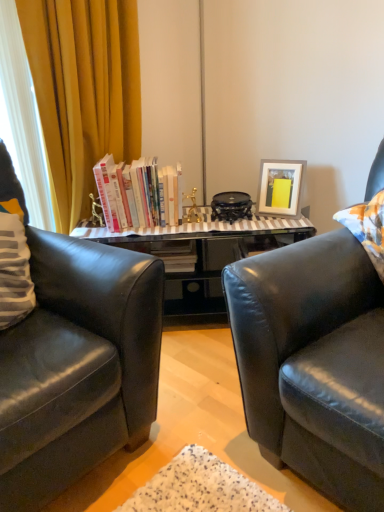
Describe the element at coordinates (77, 366) in the screenshot. I see `black leather chair at left` at that location.

This screenshot has width=384, height=512. What do you see at coordinates (138, 193) in the screenshot? I see `hardcover books at center` at bounding box center [138, 193].

Describe the element at coordinates (83, 91) in the screenshot. I see `yellow fabric curtain at left` at that location.

This screenshot has width=384, height=512. What are the coordinates of `black leather chair at left` in the screenshot? It's located at (77, 366).

In the scene shown: From a real-world perspective, relative to matte gray picture frame at upper right, is hardcover books at center vertically above or below?

hardcover books at center is above matte gray picture frame at upper right.

Can you confirm if hardcover books at center is taller than matte gray picture frame at upper right?

Correct, hardcover books at center is much taller as matte gray picture frame at upper right.

Is hardcover books at center turned away from matte gray picture frame at upper right?

No, matte gray picture frame at upper right is not at the back of hardcover books at center.

Is matte gray picture frame at upper right looking in the opposite direction of black leather chair at left?

That's not correct — matte gray picture frame at upper right is not looking away from black leather chair at left.

Between matte gray picture frame at upper right and black leather chair at left, which one appears on the left side from the viewer's perspective?

black leather chair at left is more to the left.

Would you consider matte gray picture frame at upper right to be distant from black leather chair at left?

Yes, matte gray picture frame at upper right and black leather chair at left are located far from each other.

Which object is positioned more to the right, yellow fabric curtain at left or black leather chair at left?

From the viewer's perspective, yellow fabric curtain at left appears more on the right side.

Between point (100, 34) and point (0, 380), which one is positioned in front?

The point (0, 380) is closer.

Identify the location of chair located below the yellow fabric curtain at left (from the image's perspective). (77, 366).

Is black leather chair at left placed right next to matte gray picture frame at upper right?

black leather chair at left and matte gray picture frame at upper right are not in contact.

From the image's perspective, would you say black leather chair at left is shown under matte gray picture frame at upper right?

Correct, black leather chair at left appears lower than matte gray picture frame at upper right in the image.

The width and height of the screenshot is (384, 512). I want to click on picture frame above the black leather chair at left (from the image's perspective), so click(x=280, y=187).

Can you tell me how much yellow fabric curtain at left and hardcover books at center differ in facing direction?

The angle between the facing direction of yellow fabric curtain at left and the facing direction of hardcover books at center is 41.5 degrees.

From a real-world perspective, relative to hardcover books at center, is yellow fabric curtain at left vertically above or below?

From a real-world perspective, yellow fabric curtain at left is physically above hardcover books at center.

Is yellow fabric curtain at left at the left side of hardcover books at center?

Yes, yellow fabric curtain at left is to the left of hardcover books at center.

Which of these two, black leather chair at left or yellow fabric curtain at left, stands shorter?

black leather chair at left is shorter.

Is black leather chair at left closer to the viewer compared to yellow fabric curtain at left?

That is True.

Consider the image. Considering the positions of objects black leather chair at left and yellow fabric curtain at left in the image provided, who is more to the right, black leather chair at left or yellow fabric curtain at left?

Positioned to the right is yellow fabric curtain at left.

From the image's perspective, which is above, black leather chair at left or yellow fabric curtain at left?

yellow fabric curtain at left appears higher in the image.

Is point (283, 173) closer or farther from the camera than point (56, 69)?

Point (283, 173) appears to be farther away from the viewer than point (56, 69).

What's the angular difference between matte gray picture frame at upper right and yellow fabric curtain at left's facing directions?

There is a 72.2-degree angle between the facing directions of matte gray picture frame at upper right and yellow fabric curtain at left.

Is matte gray picture frame at upper right looking in the opposite direction of yellow fabric curtain at left?

matte gray picture frame at upper right is not turned away from yellow fabric curtain at left.

Is matte gray picture frame at upper right at the right side of yellow fabric curtain at left?

Indeed, matte gray picture frame at upper right is positioned on the right side of yellow fabric curtain at left.

Where is `picture frame behind the hardcover books at center`? picture frame behind the hardcover books at center is located at coordinates (280, 187).

Locate an element on the screen. The image size is (384, 512). picture frame on the right of black leather chair at left is located at coordinates (280, 187).

Which object lies further to the anchor point matte gray picture frame at upper right, hardcover books at center or black leather chair at left?

black leather chair at left lies further to matte gray picture frame at upper right than the other object.

From the image, which object appears to be farther from hardcover books at center, black leather chair at left or yellow fabric curtain at left?

Among the two, black leather chair at left is located further to hardcover books at center.

Estimate the real-world distances between objects in this image. Which object is further from black leather chair at left, matte gray picture frame at upper right or hardcover books at center?

matte gray picture frame at upper right is positioned further to the anchor black leather chair at left.

Based on their spatial positions, is yellow fabric curtain at left or matte gray picture frame at upper right further from hardcover books at center?

matte gray picture frame at upper right is positioned further to the anchor hardcover books at center.

Considering their positions, is matte gray picture frame at upper right positioned further to yellow fabric curtain at left than hardcover books at center?

matte gray picture frame at upper right.

Which object lies further to the anchor point black leather chair at left, matte gray picture frame at upper right or yellow fabric curtain at left?

matte gray picture frame at upper right.

Looking at the image, which one is located closer to black leather chair at left, hardcover books at center or yellow fabric curtain at left?

Based on the image, hardcover books at center appears to be nearer to black leather chair at left.

Which object lies further to the anchor point matte gray picture frame at upper right, black leather chair at left or yellow fabric curtain at left?

black leather chair at left lies further to matte gray picture frame at upper right than the other object.

At what (x,y) coordinates should I click in order to perform the action: click on curtain located between black leather chair at left and matte gray picture frame at upper right in the depth direction. Please return your answer as a coordinate pair (x, y). This screenshot has height=512, width=384. Looking at the image, I should click on (83, 91).

You are a GUI agent. You are given a task and a screenshot of the screen. Output one action in this format:
    pyautogui.click(x=<x>, y=<y>)
    Task: Click on the book situated between yellow fabric curtain at left and matte gray picture frame at upper right from left to right
    The image size is (384, 512).
    Given the screenshot: What is the action you would take?
    pyautogui.click(x=138, y=193)

Locate an element on the screen. This screenshot has height=512, width=384. curtain between black leather chair at left and hardcover books at center in the front-back direction is located at coordinates (83, 91).

Where is `book positioned between black leather chair at left and matte gray picture frame at upper right from near to far`? The width and height of the screenshot is (384, 512). book positioned between black leather chair at left and matte gray picture frame at upper right from near to far is located at coordinates (138, 193).